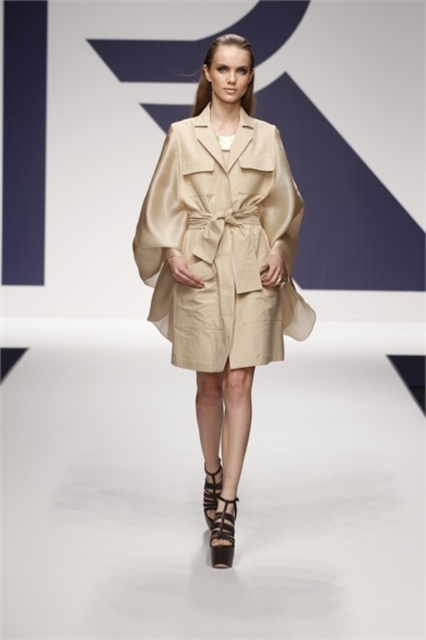
Question: Which of the following is the farthest from the observer?

Choices:
 (A) beige satin coat at center
 (B) brown leather sandal at lower center

Answer: (B)

Question: Which point is closer to the camera?

Choices:
 (A) brown leather sandal at lower center
 (B) beige satin coat at center
 (C) leather/black textured sandal at lower center

Answer: (C)

Question: Can you confirm if beige satin coat at center is positioned above leather/black textured sandal at lower center?

Choices:
 (A) yes
 (B) no

Answer: (A)

Question: Can you confirm if beige satin coat at center is positioned above leather/black textured sandal at lower center?

Choices:
 (A) yes
 (B) no

Answer: (A)

Question: Among these points, which one is nearest to the camera?

Choices:
 (A) (227, 502)
 (B) (215, 474)
 (C) (273, 292)

Answer: (A)

Question: Does leather/black textured sandal at lower center have a lesser width compared to brown leather sandal at lower center?

Choices:
 (A) no
 (B) yes

Answer: (A)